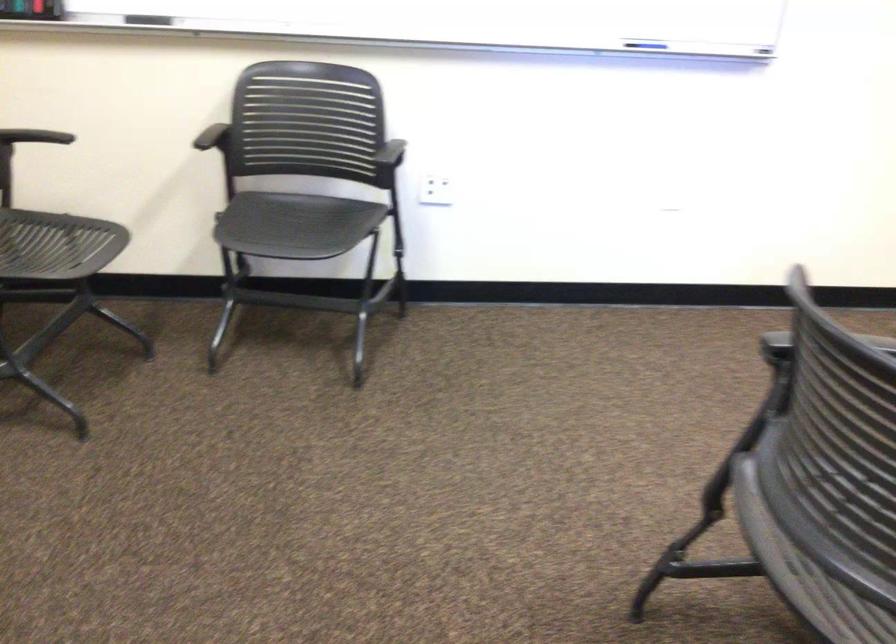
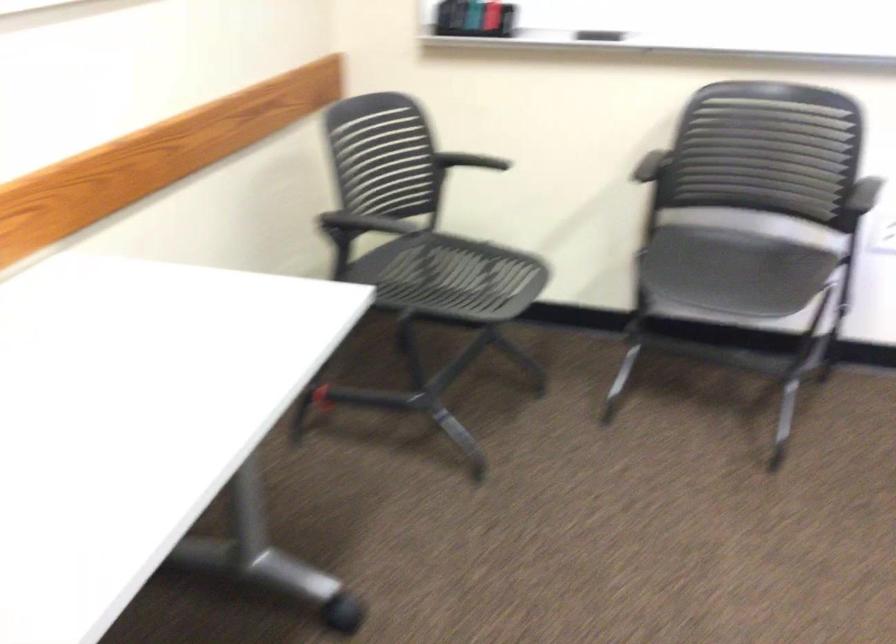
The point at (302, 227) is marked in the first image. Where is the corresponding point in the second image?

(731, 270)